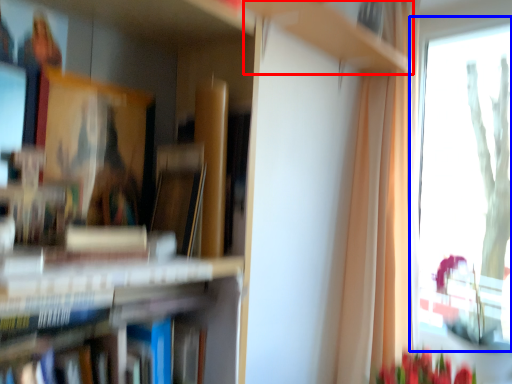
Question: Which of the following is the farthest to the observer, cabinet (highlighted by a red box) or window (highlighted by a blue box)?

Choices:
 (A) cabinet
 (B) window

Answer: (B)